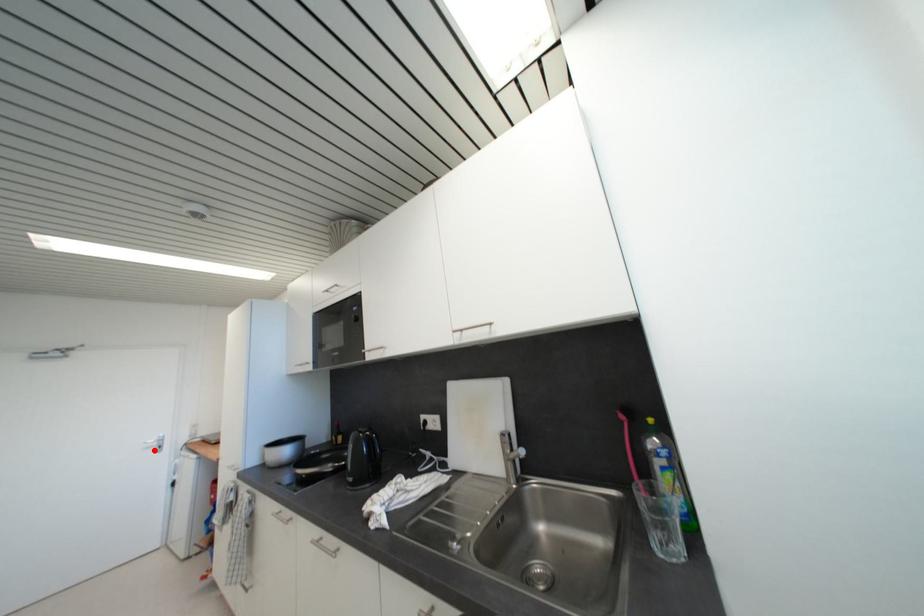
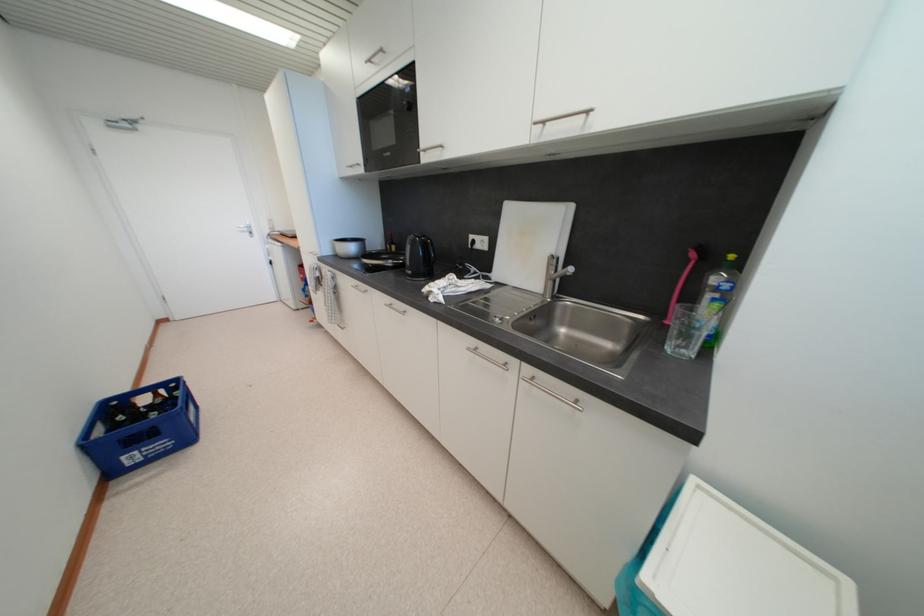
Find the pixel in the second image that matches the highlighted location in the first image.

(248, 235)